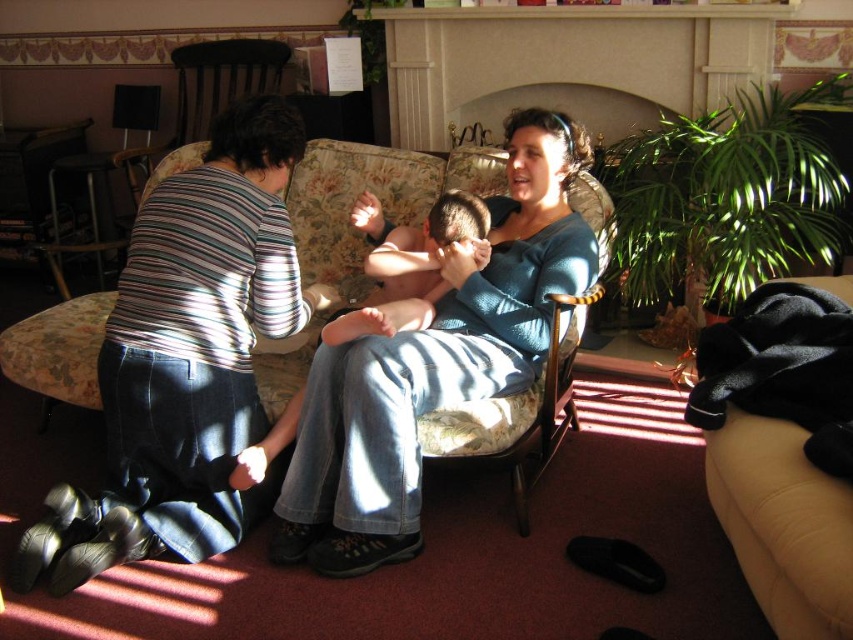
Does dark blue jeans at lower left appear over smooth skin baby at center?

Actually, dark blue jeans at lower left is below smooth skin baby at center.

Does dark blue jeans at lower left have a larger size compared to smooth skin baby at center?

Correct, dark blue jeans at lower left is larger in size than smooth skin baby at center.

Is point (128, 378) positioned after point (364, 193)?

That is False.

The height and width of the screenshot is (640, 853). I want to click on dark blue jeans at lower left, so click(x=186, y=360).

Measure the distance between beige fabric couch at lower right and camera.

The distance of beige fabric couch at lower right from camera is 4.04 feet.

Locate an element on the screen. The width and height of the screenshot is (853, 640). beige fabric couch at lower right is located at coordinates (782, 525).

Image resolution: width=853 pixels, height=640 pixels. Describe the element at coordinates (782, 525) in the screenshot. I see `beige fabric couch at lower right` at that location.

Image resolution: width=853 pixels, height=640 pixels. Find the location of `beige fabric couch at lower right`. beige fabric couch at lower right is located at coordinates (782, 525).

Who is more distant from viewer, (294,557) or (399,284)?

The point (399,284) is more distant.

Is blue denim jeans at center above smooth skin baby at center?

No.

Does point (378, 374) lie behind point (479, 227)?

No, it is not.

This screenshot has height=640, width=853. Identify the location of blue denim jeans at center. (428, 362).